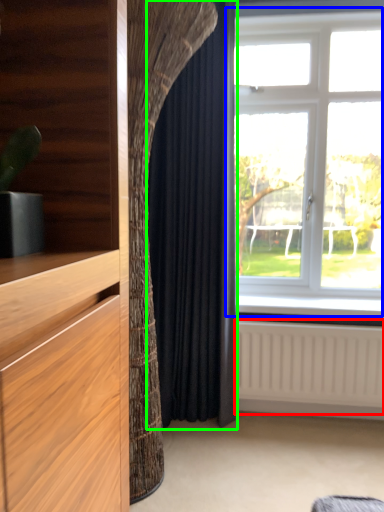
Question: Which object is positioned closest to radiator (highlighted by a red box)? Select from window (highlighted by a blue box) and curtain (highlighted by a green box).

Choices:
 (A) window
 (B) curtain

Answer: (B)